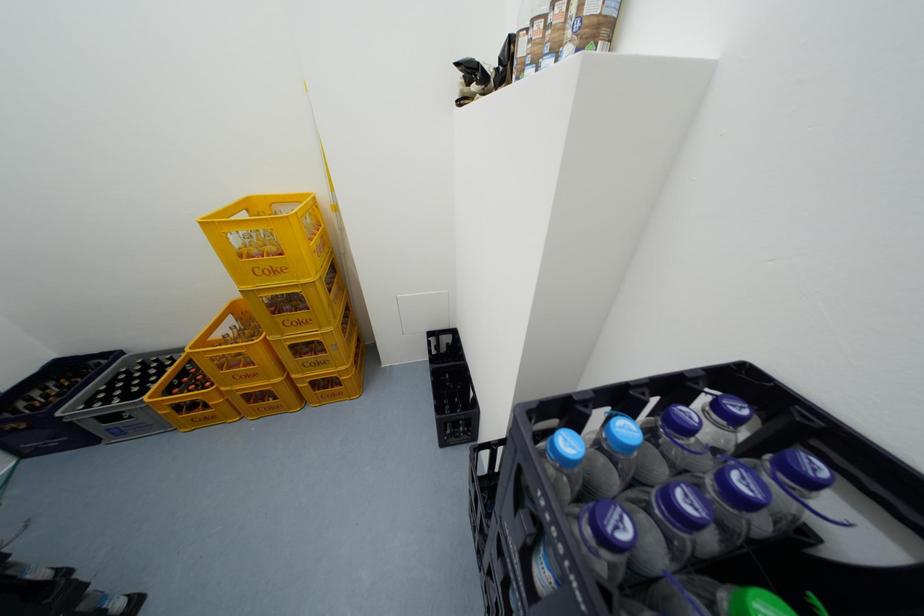
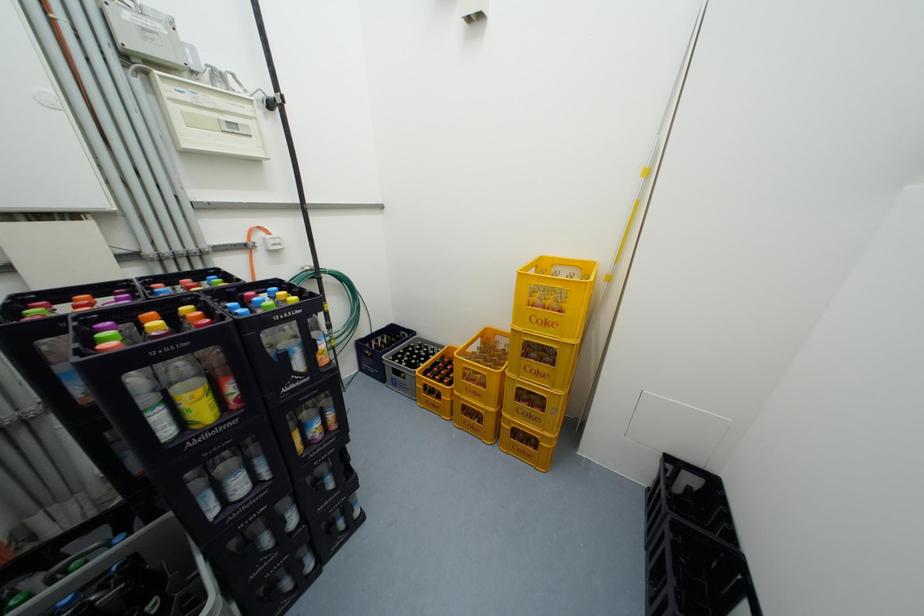
Question: The camera is either moving clockwise (left) or counter-clockwise (right) around the object. The first image is from the beginning of the video and the second image is from the end. Is the camera moving left or right when shooting the video?

Choices:
 (A) Left
 (B) Right

Answer: (B)